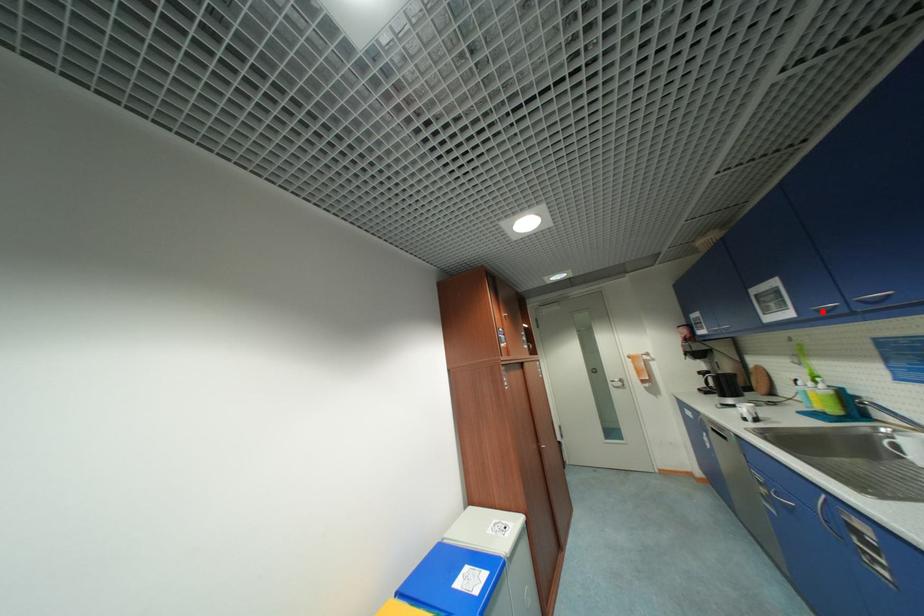
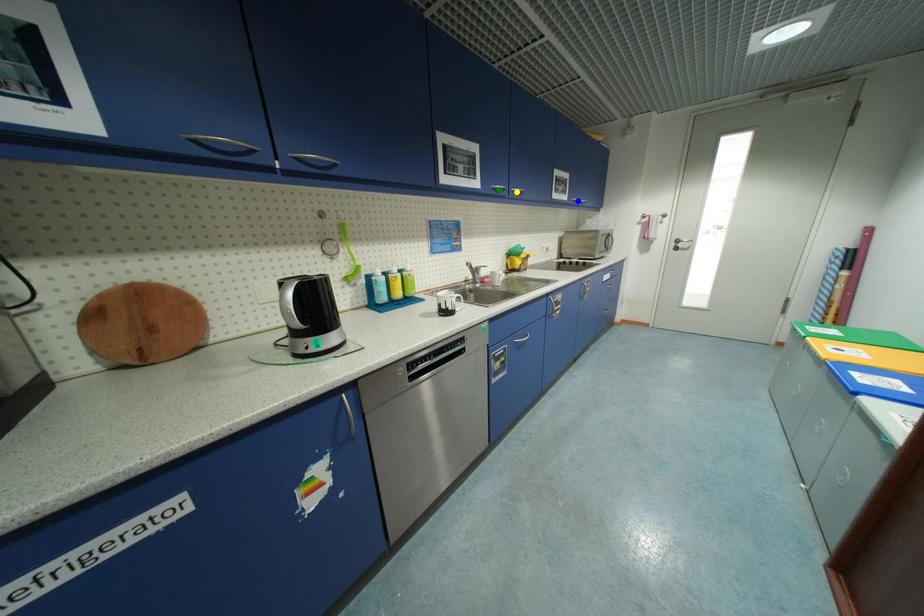
Question: I am providing you with two images of the same scene from different viewpoints. A red point is marked on the first image. You are given multiple points on the second image. Which point in image 2 represents the same 3d spot as the red point in image 1?

Choices:
 (A) yellow point
 (B) blue point
 (C) green point

Answer: (C)